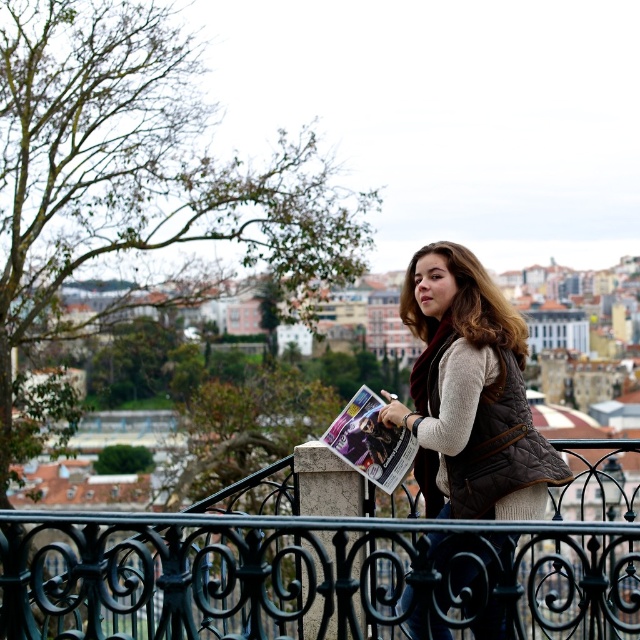
Question: Which object appears closest to the camera in this image?

Choices:
 (A) brown quilted vest at center
 (B) black wrought iron fence at center

Answer: (B)

Question: Can you confirm if black wrought iron fence at center is wider than matte paper magazine at center?

Choices:
 (A) no
 (B) yes

Answer: (B)

Question: Among these points, which one is nearest to the camera?

Choices:
 (A) (520, 346)
 (B) (364, 424)
 (C) (44, 570)

Answer: (B)

Question: Among these points, which one is farthest from the camera?

Choices:
 (A) 328,440
 (B) 509,609
 (C) 452,397

Answer: (A)

Question: Is black wrought iron fence at center thinner than matte paper magazine at center?

Choices:
 (A) yes
 (B) no

Answer: (B)

Question: Can you confirm if black wrought iron fence at center is wider than brown quilted vest at center?

Choices:
 (A) no
 (B) yes

Answer: (B)